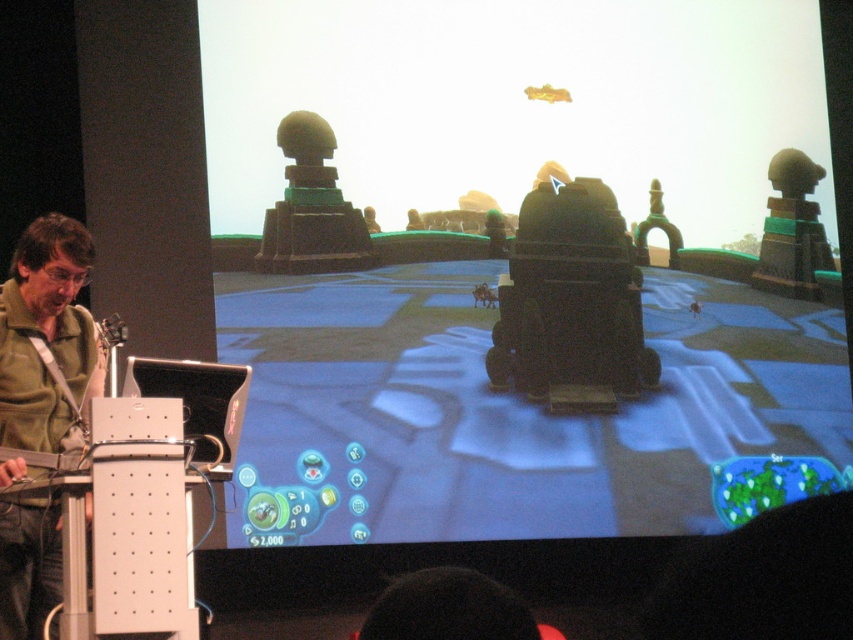
Question: In this image, where is matte black projector screen at center located relative to green matte shirt at left?

Choices:
 (A) above
 (B) below

Answer: (A)

Question: Does matte black projector screen at center appear over green matte shirt at left?

Choices:
 (A) no
 (B) yes

Answer: (B)

Question: Which object appears farthest from the camera in this image?

Choices:
 (A) green matte shirt at left
 (B) matte black projector screen at center

Answer: (B)

Question: Is matte black projector screen at center closer to the viewer compared to green matte shirt at left?

Choices:
 (A) no
 (B) yes

Answer: (A)

Question: Which of the following is the closest to the observer?

Choices:
 (A) (57, 352)
 (B) (457, 212)

Answer: (A)